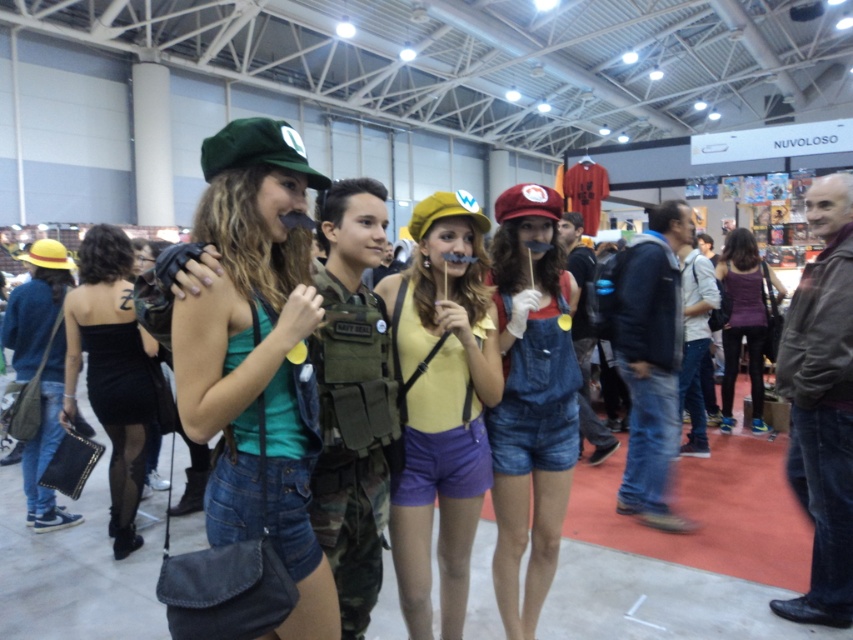
Which is behind, point (296, 413) or point (97, 365)?

Positioned behind is point (97, 365).

How much distance is there between matte green cap at upper left and black satin dress at left?

A distance of 6.86 feet exists between matte green cap at upper left and black satin dress at left.

Between point (323, 589) and point (125, 397), which one is positioned in front?

Point (323, 589) is more forward.

Where is `matte green cap at upper left`? matte green cap at upper left is located at coordinates (254, 353).

Looking at this image, is black satin dress at left thinner than purple matte tank top at center?

Indeed, black satin dress at left has a lesser width compared to purple matte tank top at center.

Is point (126, 476) positioned after point (738, 285)?

No, it is not.

Where is `black satin dress at left`? The height and width of the screenshot is (640, 853). black satin dress at left is located at coordinates (111, 371).

Between point (206, 280) and point (457, 193), which one is positioned in front?

Point (206, 280) is in front.

Locate an element on the screen. This screenshot has width=853, height=640. matte green cap at upper left is located at coordinates (254, 353).

Is point (262, 481) closer to camera compared to point (410, 532)?

Yes, point (262, 481) is in front of point (410, 532).

I want to click on matte green cap at upper left, so click(x=254, y=353).